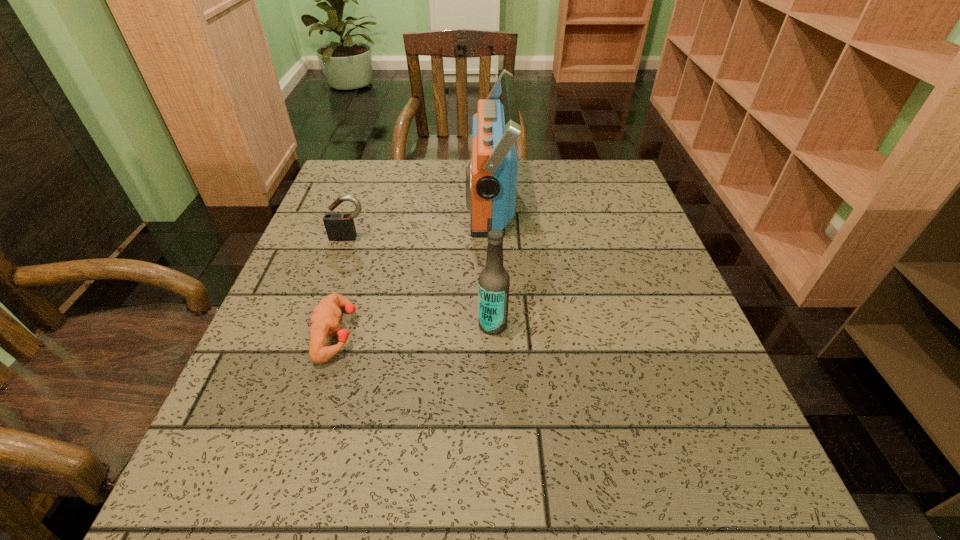
The image size is (960, 540). Identify the location of free spot between the puncher and the third tallest object. (343, 286).

The width and height of the screenshot is (960, 540). I want to click on vacant space in between the puncher and the padlock, so click(x=343, y=286).

Find the location of a particular element. vacant space that's between the third shortest object and the third tallest object is located at coordinates (421, 281).

Locate an element on the screen. This screenshot has width=960, height=540. the closest object to the puncher is located at coordinates (339, 226).

Find the location of a particular element. The width and height of the screenshot is (960, 540). the third closest object to the third shortest object is located at coordinates [339, 226].

I want to click on free spot that satisfies the following two spatial constraints: 1. on the front-facing side of the radio receiver; 2. with the keyhole on the front of the second shortest object, so click(x=491, y=238).